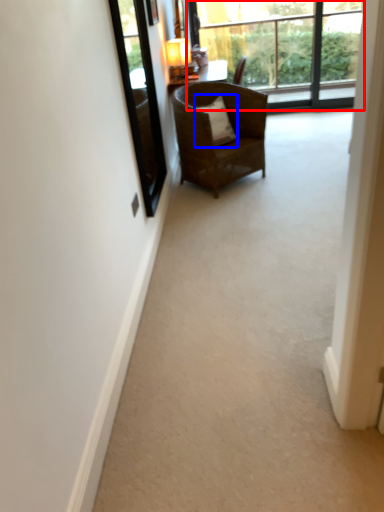
Question: Among these objects, which one is farthest to the camera, window (highlighted by a red box) or pillow (highlighted by a blue box)?

Choices:
 (A) window
 (B) pillow

Answer: (A)